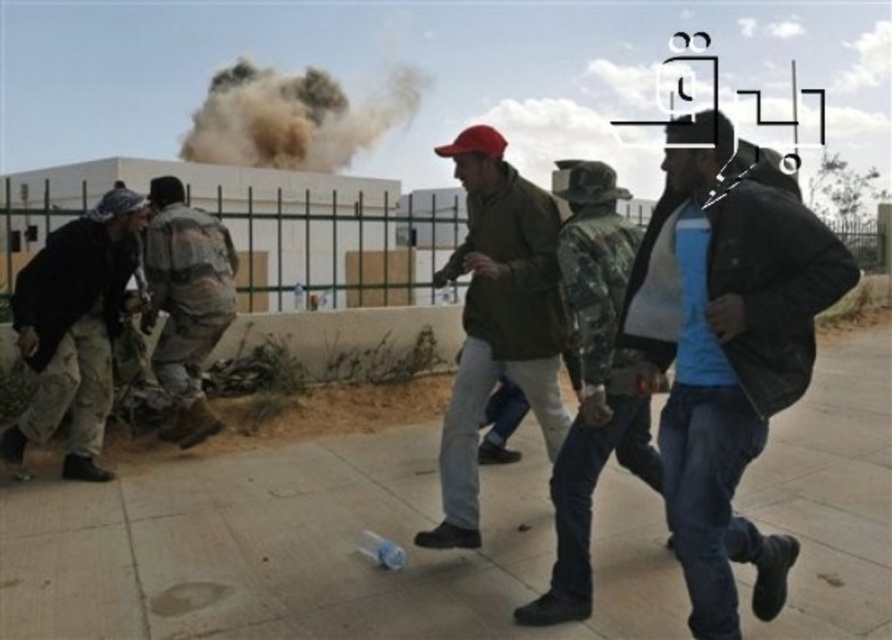
Question: Can you confirm if green matte jacket at center is wider than camouflage pants at left?

Choices:
 (A) no
 (B) yes

Answer: (A)

Question: Among these objects, which one is nearest to the camera?

Choices:
 (A) green matte jacket at center
 (B) camouflage jacket at center
 (C) brown dusty cloud at upper center

Answer: (B)

Question: Does smooth concrete pavement at center appear on the right side of brown dusty cloud at upper center?

Choices:
 (A) yes
 (B) no

Answer: (A)

Question: Among these objects, which one is nearest to the camera?

Choices:
 (A) blue denim jeans at center
 (B) brown dusty cloud at upper center
 (C) smooth concrete pavement at center

Answer: (A)

Question: Observing the image, what is the correct spatial positioning of smooth concrete pavement at center in reference to blue denim jeans at center?

Choices:
 (A) right
 (B) left

Answer: (A)

Question: Considering the real-world distances, which object is closest to the smooth concrete pavement at center?

Choices:
 (A) camouflage uniform at center
 (B) camouflage jacket at center
 (C) camouflage pants at left
 (D) brown dusty cloud at upper center

Answer: (B)